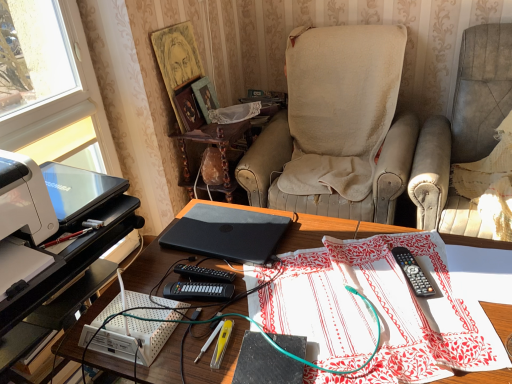
Find the location of a particular element. Image resolution: width=512 pixels, height=384 pixels. vacant space to the right of black plastic keyboard at center, which appears as the first stationery when viewed from the left is located at coordinates (264, 290).